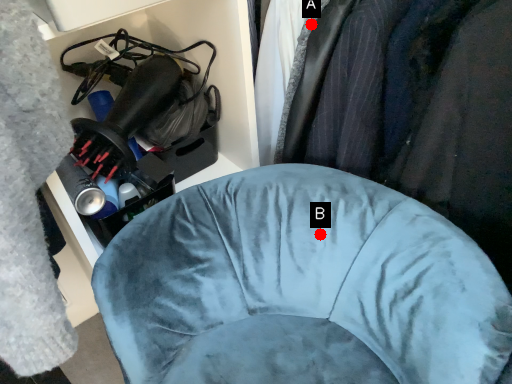
Question: Two points are circled on the image, labeled by A and B beside each circle. Which point is closer to the camera?

Choices:
 (A) A is closer
 (B) B is closer

Answer: (B)